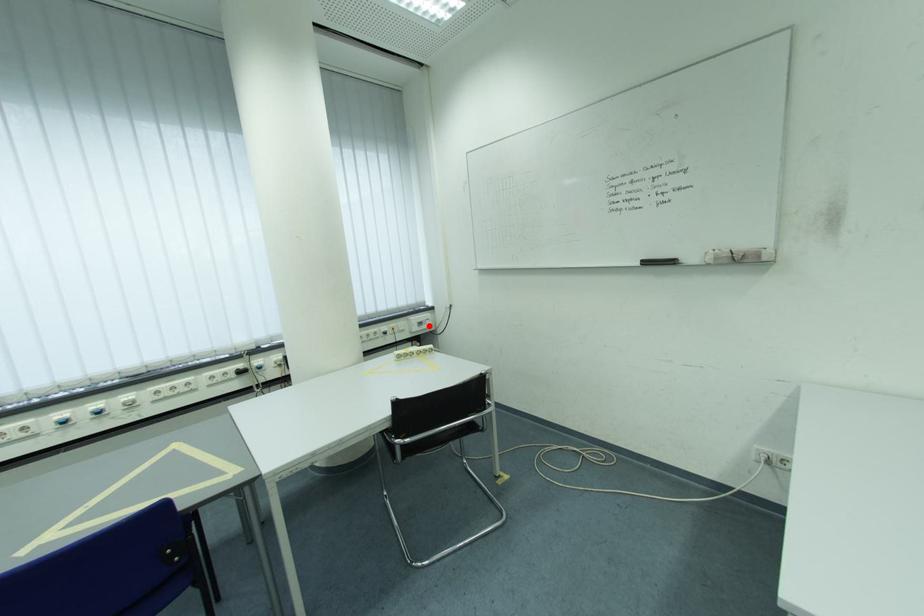
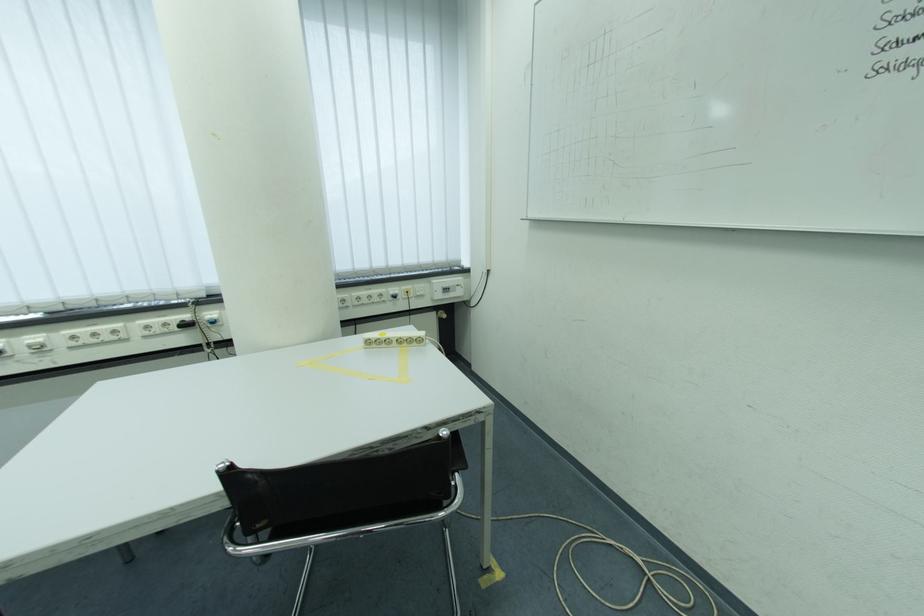
The point at the highlighted location is marked in the first image. Where is the corresponding point in the second image?

(455, 292)